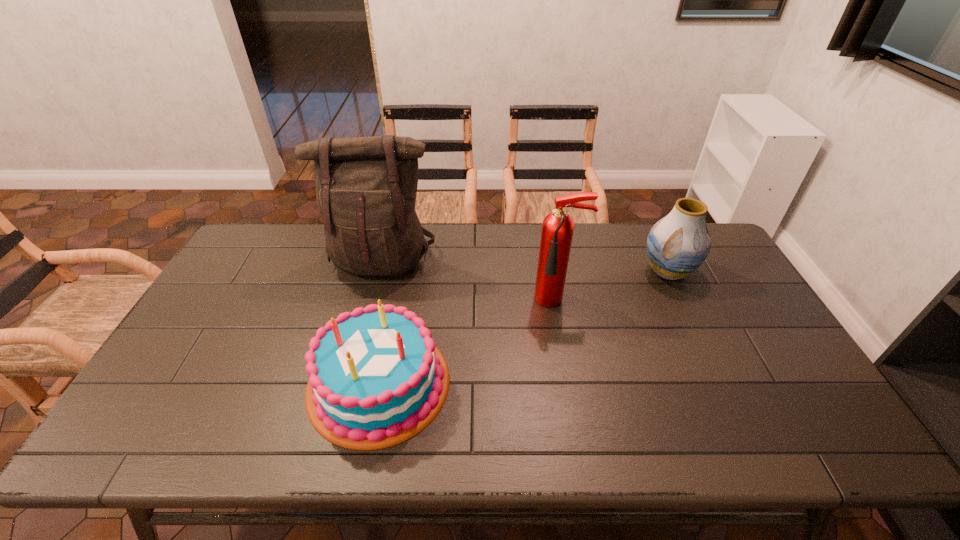
You are a GUI agent. You are given a task and a screenshot of the screen. Output one action in this format:
    pyautogui.click(x=<x>, y=<y>)
    Task: Click on the vase at the far edge
    The width and height of the screenshot is (960, 540).
    Given the screenshot: What is the action you would take?
    point(678,244)

Find the location of a particular element. object that is at the near edge is located at coordinates (374, 378).

Find the location of `object at the right edge`. object at the right edge is located at coordinates (678, 244).

Locate an element on the screen. The height and width of the screenshot is (540, 960). object present at the far right corner is located at coordinates (678, 244).

Where is `free location at the far edge`? free location at the far edge is located at coordinates (522, 235).

Locate an element on the screen. The height and width of the screenshot is (540, 960). vacant space at the near edge of the desktop is located at coordinates (226, 436).

In the image, there is a desktop. Where is `blank space at the left edge`? blank space at the left edge is located at coordinates (233, 349).

Where is `vacant space at the right edge`? Image resolution: width=960 pixels, height=540 pixels. vacant space at the right edge is located at coordinates (795, 400).

The height and width of the screenshot is (540, 960). I want to click on free space at the far left corner of the desktop, so click(247, 254).

In the image, there is a desktop. Identify the location of vacant space at the near left corner. The image size is (960, 540). (151, 422).